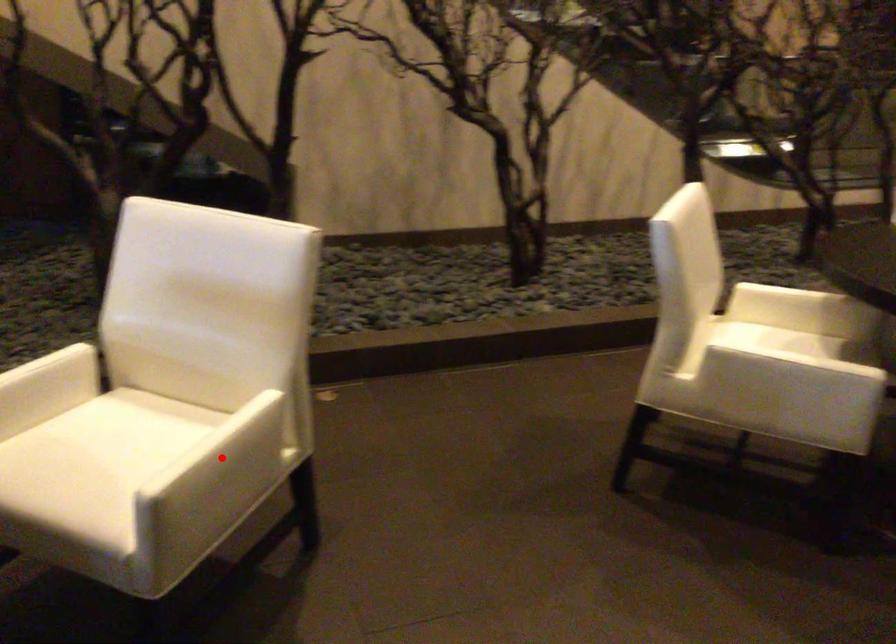
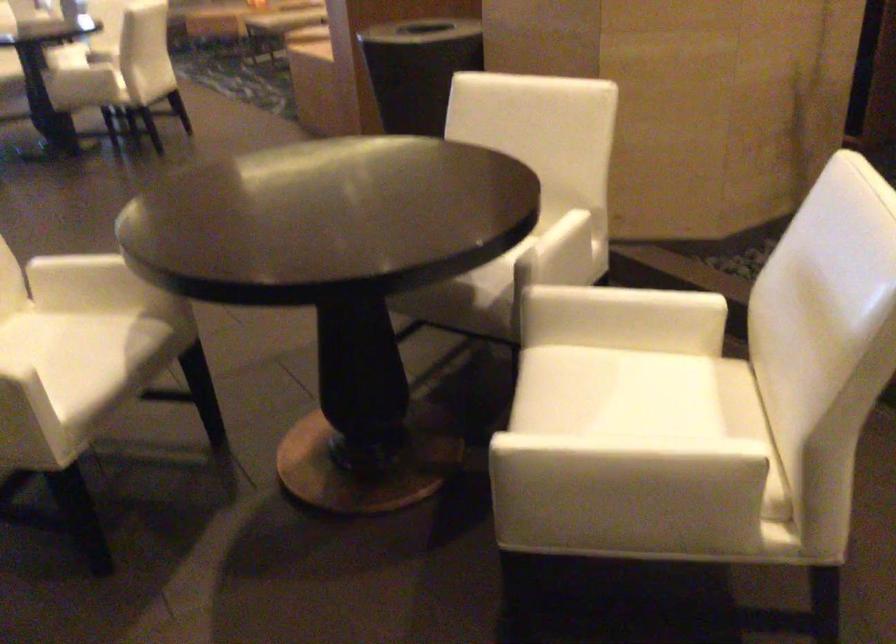
Question: I am providing you with two images of the same scene from different viewpoints. Image1 has a red point marked. In image2, the corresponding 3D location appears at what relative position? Reply with the corresponding letter.

Choices:
 (A) Closer
 (B) Farther

Answer: (A)